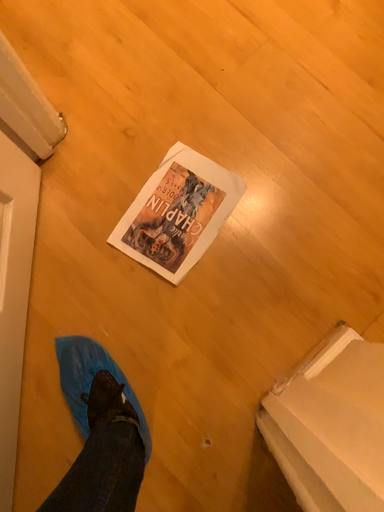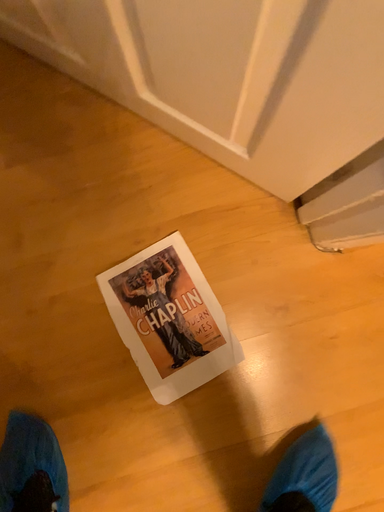
Question: Which way did the camera rotate in the video?

Choices:
 (A) rotated right
 (B) rotated left

Answer: (B)